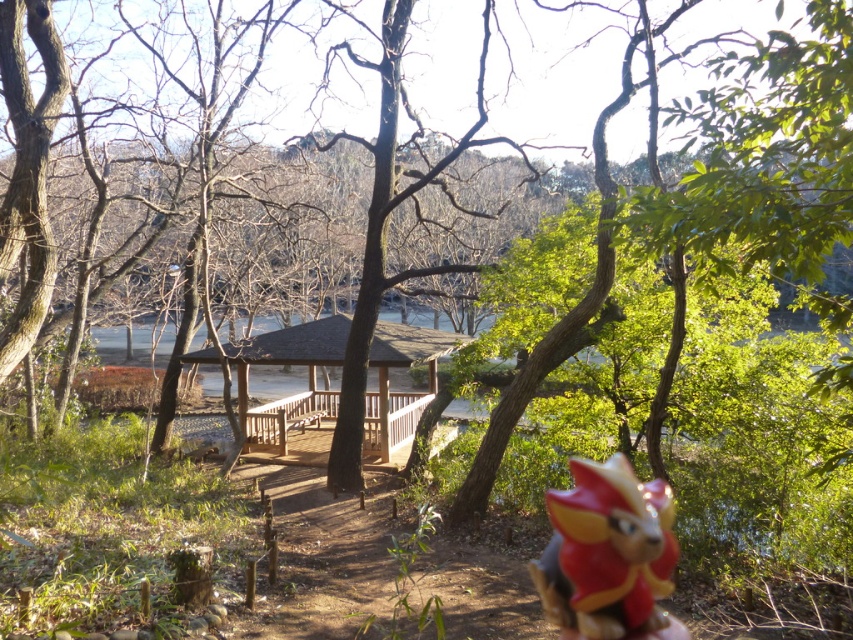
You are a photographer standing at the camera position. You want to pick up the shiny plastic toy at lower right to avoid it being in the photo. Can you reach it without moving from your current position if your longest reach is 5 meters?

The shiny plastic toy at lower right and camera are 5.30 meters apart. Since your longest reach is 5 meters, you cannot reach the shiny plastic toy at lower right without moving from your current position.

You are a park visitor who accidentally dropped a shiny plastic toy at lower right while walking towards the wooden gazebo at center. Can you see the toy from the gazebo?

The shiny plastic toy at lower right is below the wooden gazebo at center, so if you are standing on the gazebo, you might be able to see it depending on the slope and visibility. However, since it is positioned below, there is a chance it could be obscured by the gazebo structure or surrounding terrain. Without additional details, it is uncertain.

You are a visitor in the park and you see the shiny plastic toy at lower right and the wooden gazebo at center. Which object is taller?

The shiny plastic toy at lower right is taller than the wooden gazebo at center according to the description.